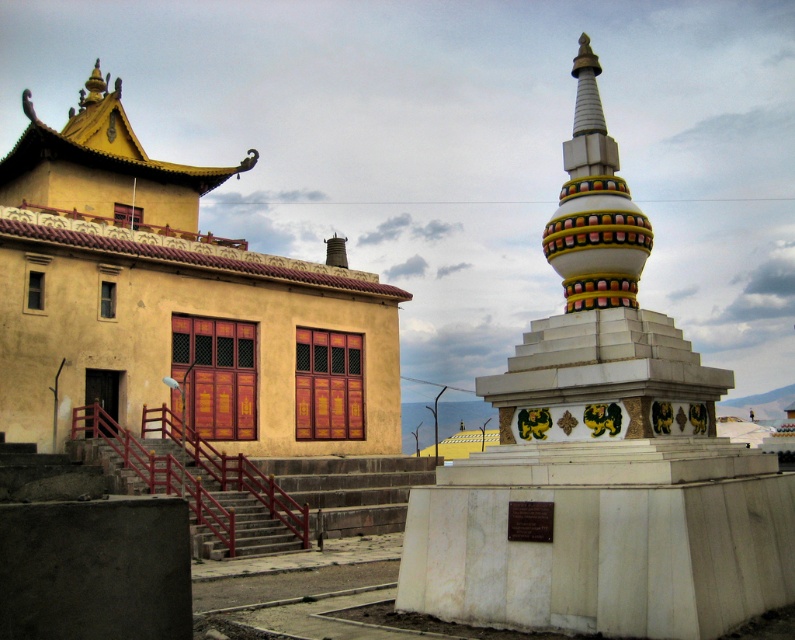
Consider the image. Is metallic red stairs at center smaller than white glossy stupa at center?

Result: No, metallic red stairs at center is not smaller than white glossy stupa at center.

Who is more distant from viewer, [247,536] or [623,198]?

Positioned behind is point [247,536].

Find the location of `metallic red stairs at center`. metallic red stairs at center is located at coordinates (x=351, y=490).